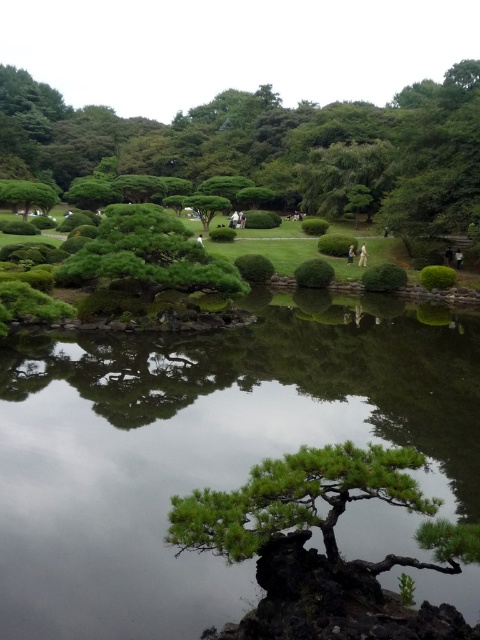
You are a gardener planning to prune the green leafy bush at upper center and the green textured tree at center. Which one is closer to you from your current position in the garden?

The green leafy bush at upper center is closer to you because the green textured tree at center is positioned behind it.

You are a landscape architect designing a new Japanese garden. You want to place a decorative stone lantern exactly at the center of the green reflective water at center. Based on the coordinates provided, where should you place the lantern?

The green reflective water at center is positioned at coordinates point (204, 451), so the decorative stone lantern should be placed at those coordinates to center it.